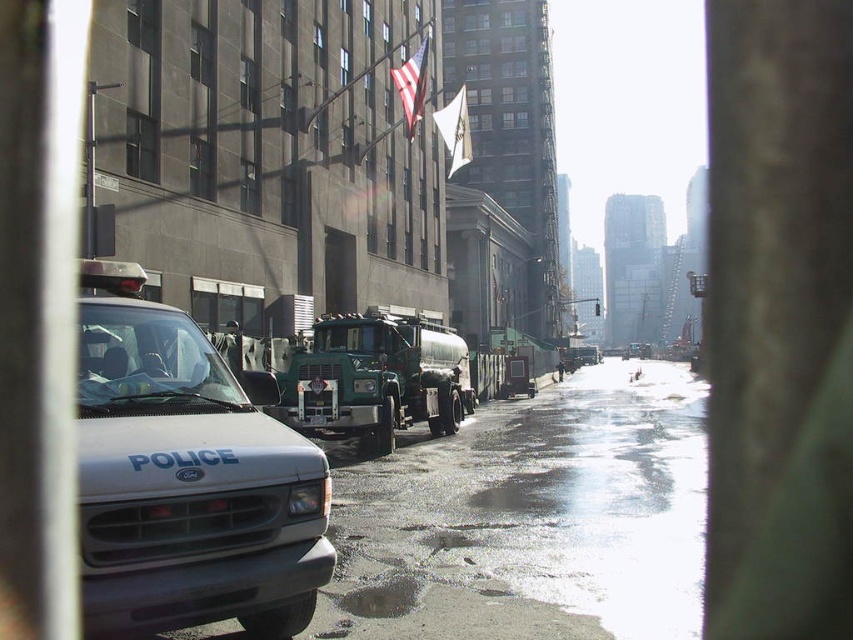
Question: Among these objects, which one is farthest from the camera?

Choices:
 (A) green matte tanker truck at center
 (B) white matte police van at left

Answer: (A)

Question: Can you confirm if white matte police van at left is thinner than green matte tanker truck at center?

Choices:
 (A) yes
 (B) no

Answer: (A)

Question: Is white matte police van at left wider than green matte tanker truck at center?

Choices:
 (A) yes
 (B) no

Answer: (B)

Question: Does white matte police van at left appear on the left side of green matte tanker truck at center?

Choices:
 (A) yes
 (B) no

Answer: (A)

Question: Which point appears closest to the camera in this image?

Choices:
 (A) (465, 364)
 (B) (247, 620)

Answer: (B)

Question: Which of the following is the farthest from the observer?

Choices:
 (A) (421, 401)
 (B) (202, 593)

Answer: (A)